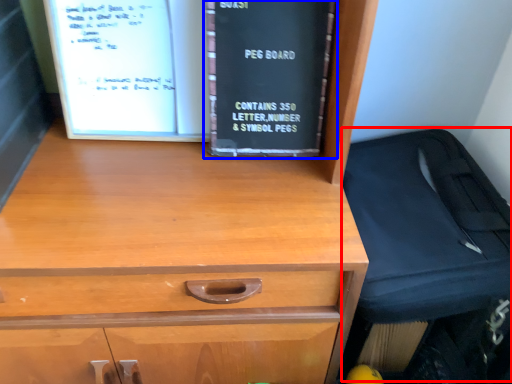
Question: Among these objects, which one is nearest to the camera, luggage (highlighted by a red box) or book (highlighted by a blue box)?

Choices:
 (A) luggage
 (B) book

Answer: (A)